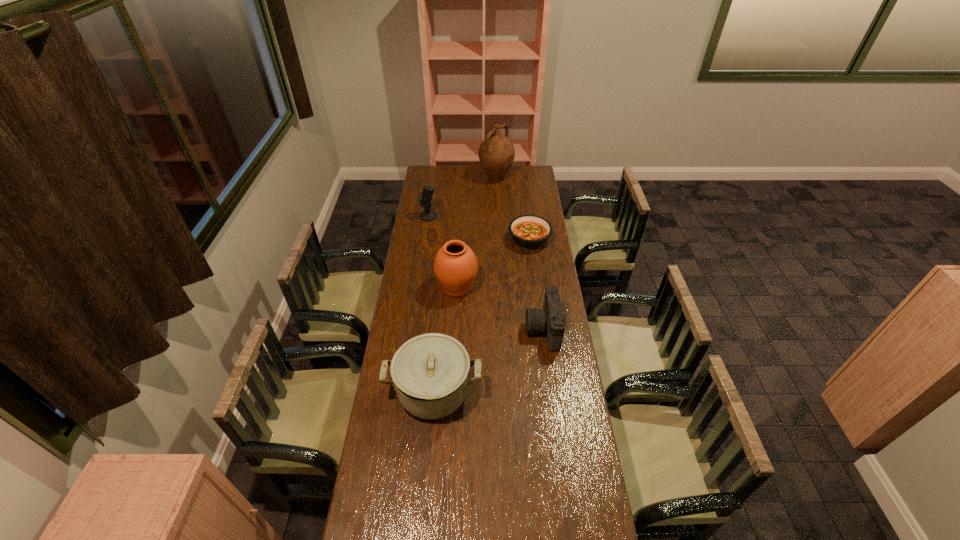
Identify the location of microphone located in the left edge section of the desktop. The height and width of the screenshot is (540, 960). pos(428,215).

This screenshot has height=540, width=960. Identify the location of saucepan that is positioned at the left edge. (430, 373).

Where is `camera that is at the right edge`? The height and width of the screenshot is (540, 960). camera that is at the right edge is located at coordinates (550, 319).

Locate an element on the screen. stew situated at the right edge is located at coordinates (528, 231).

Where is `vacant region at the far edge of the desktop`? Image resolution: width=960 pixels, height=540 pixels. vacant region at the far edge of the desktop is located at coordinates (512, 174).

Image resolution: width=960 pixels, height=540 pixels. Find the location of `blank area at the left edge`. blank area at the left edge is located at coordinates (415, 249).

The height and width of the screenshot is (540, 960). I want to click on vacant space at the right edge of the desktop, so click(x=555, y=408).

You are a GUI agent. You are given a task and a screenshot of the screen. Output one action in this format:
    pyautogui.click(x=<x>, y=<y>)
    Task: Click on the free space at the far right corner of the desktop
    This screenshot has width=960, height=540.
    Given the screenshot: What is the action you would take?
    pyautogui.click(x=538, y=178)

Find the location of a particular element. free spot between the shortest object and the fifth shortest object is located at coordinates (493, 263).

Identify the location of vacant area that lies between the fifth tallest object and the saucepan. (489, 361).